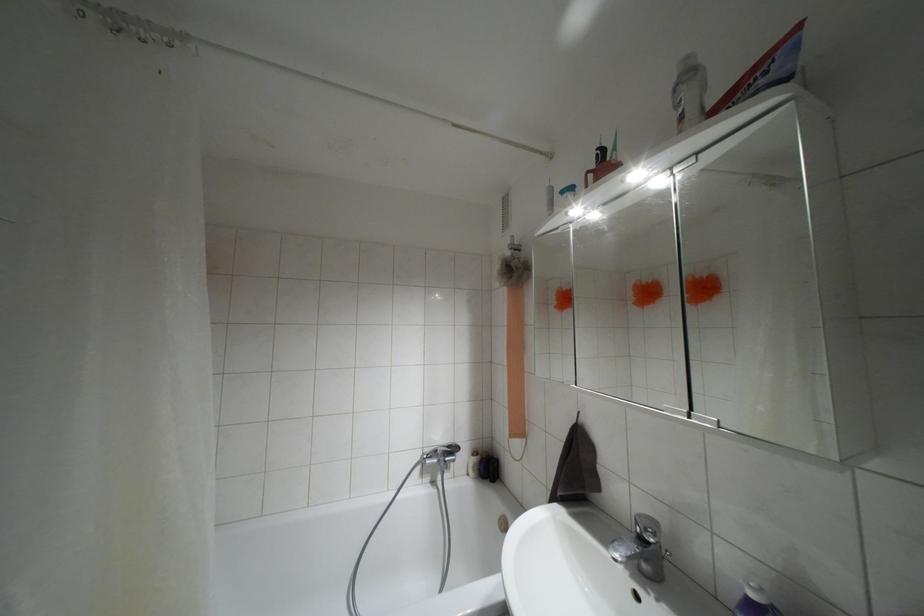
Where would you turn the bathtub faucet lever? Please return your answer as a coordinate pair (x, y).

(447, 450)